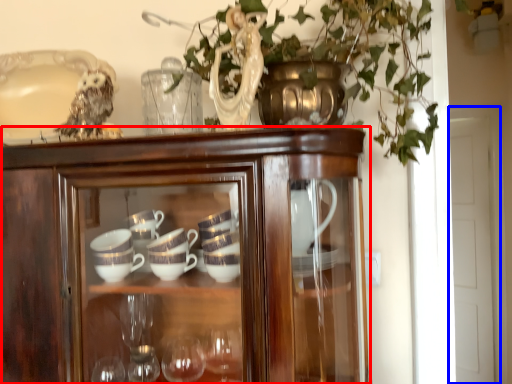
Question: Which of the following is the farthest to the observer, cupboard (highlighted by a red box) or glass door (highlighted by a blue box)?

Choices:
 (A) cupboard
 (B) glass door

Answer: (B)